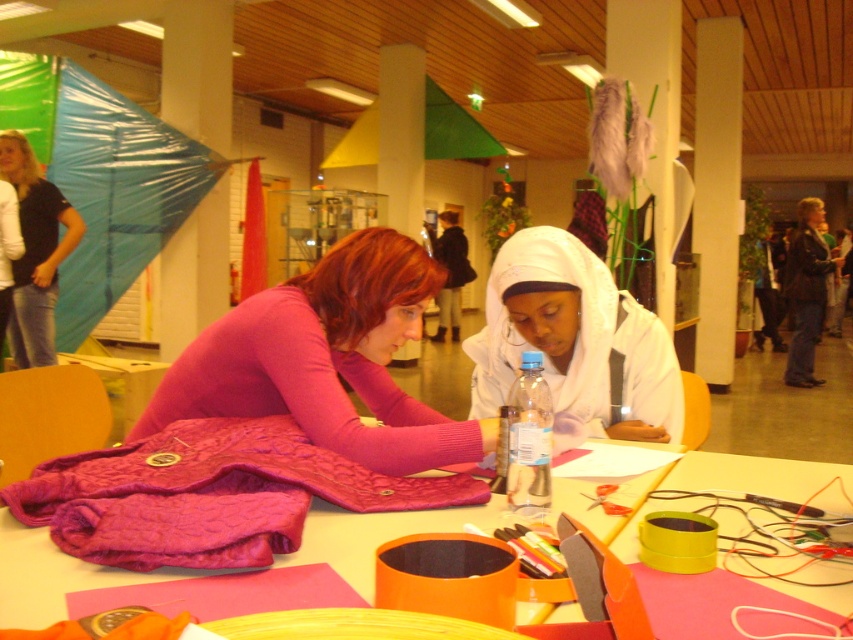
Question: Can you confirm if white matte hijab at center is smaller than quilted fabric jacket at center?

Choices:
 (A) yes
 (B) no

Answer: (B)

Question: Which object is closer to the camera taking this photo?

Choices:
 (A) white matte hijab at center
 (B) quilted fabric jacket at center
 (C) clear plastic bottle at center
 (D) quilted pink fabric at center

Answer: (B)

Question: Can you confirm if quilted pink fabric at center is wider than clear plastic bottle at center?

Choices:
 (A) yes
 (B) no

Answer: (A)

Question: Which point is closer to the camera?

Choices:
 (A) (140, 532)
 (B) (560, 448)
 (C) (328, 428)

Answer: (A)

Question: Estimate the real-world distances between objects in this image. Which object is closer to the quilted pink fabric at center?

Choices:
 (A) matte pink sweater at center
 (B) quilted fabric jacket at center
 (C) white matte hijab at center

Answer: (B)

Question: Is matte pink sweater at center smaller than quilted fabric jacket at center?

Choices:
 (A) no
 (B) yes

Answer: (A)